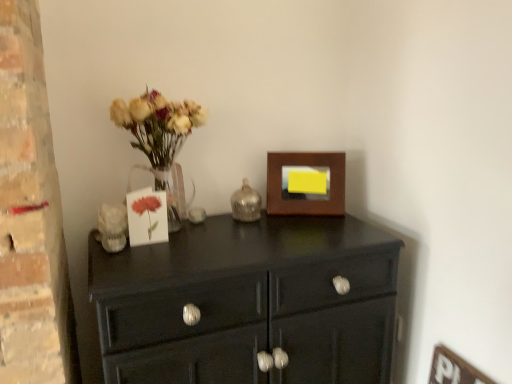
I want to click on free space to the left of wooden picture frame at upper right, so click(x=259, y=221).